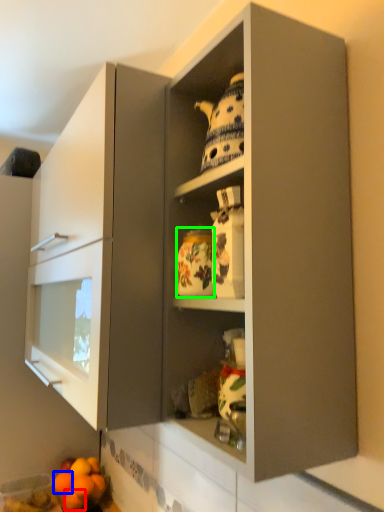
Question: Based on their relative distances, which object is farther from orange (highlighted by a red box)? Choose from orange (highlighted by a blue box) and pottery (highlighted by a green box).

Choices:
 (A) orange
 (B) pottery

Answer: (B)